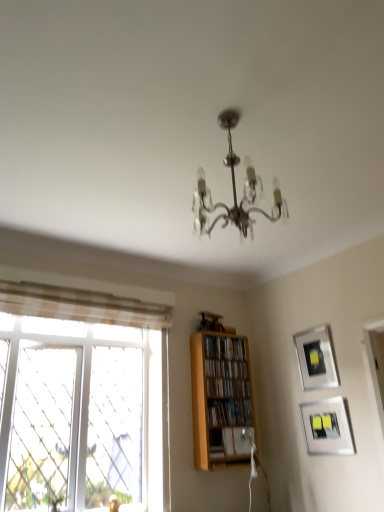
Question: Can you confirm if wooden bookshelf at center, marked as the 1th book in a top-to-bottom arrangement, is smaller than wooden bookshelf at center, the second book viewed from the top?

Choices:
 (A) yes
 (B) no

Answer: (B)

Question: Considering the relative sizes of wooden bookshelf at center, acting as the fifth book starting from the bottom, and wooden bookshelf at center, the 4th book from the bottom, in the image provided, is wooden bookshelf at center, acting as the fifth book starting from the bottom, taller than wooden bookshelf at center, the 4th book from the bottom,?

Choices:
 (A) no
 (B) yes

Answer: (B)

Question: Is wooden bookshelf at center, marked as the 1th book in a top-to-bottom arrangement, thinner than wooden bookshelf at center, the second book viewed from the top?

Choices:
 (A) yes
 (B) no

Answer: (B)

Question: Is wooden bookshelf at center, acting as the fifth book starting from the bottom, not within wooden bookshelf at center, the second book viewed from the top?

Choices:
 (A) no
 (B) yes

Answer: (B)

Question: Can you confirm if wooden bookshelf at center, marked as the 1th book in a top-to-bottom arrangement, is positioned to the right of wooden bookshelf at center, the 4th book from the bottom?

Choices:
 (A) yes
 (B) no

Answer: (B)

Question: Considering the positions of wooden bookshelf at center, the second book viewed from the top, and wooden shelf at center in the image, is wooden bookshelf at center, the second book viewed from the top, wider or thinner than wooden shelf at center?

Choices:
 (A) thin
 (B) wide

Answer: (A)

Question: From a real-world perspective, is wooden bookshelf at center, the second book viewed from the top, positioned above or below wooden shelf at center?

Choices:
 (A) below
 (B) above

Answer: (B)

Question: From the image's perspective, is wooden bookshelf at center, the second book viewed from the top, located above or below wooden shelf at center?

Choices:
 (A) above
 (B) below

Answer: (A)

Question: Would you say wooden bookshelf at center, the 4th book from the bottom, is inside or outside wooden shelf at center?

Choices:
 (A) outside
 (B) inside

Answer: (B)

Question: Does point (29, 350) appear closer or farther from the camera than point (337, 434)?

Choices:
 (A) farther
 (B) closer

Answer: (A)

Question: Would you say clear glass window at left is to the left or to the right of matte silver picture frame at lower right, the 1th picture frame from the bottom, in the picture?

Choices:
 (A) right
 (B) left

Answer: (B)

Question: Is clear glass window at left bigger or smaller than matte silver picture frame at lower right, which appears as the second picture frame when viewed from the top?

Choices:
 (A) big
 (B) small

Answer: (A)

Question: Would you say clear glass window at left is inside or outside matte silver picture frame at lower right, the 1th picture frame from the bottom?

Choices:
 (A) inside
 (B) outside

Answer: (B)

Question: In terms of size, does wooden bookshelf at center, the 3th book from the bottom, appear bigger or smaller than wooden bookshelf at center, acting as the fifth book starting from the bottom?

Choices:
 (A) small
 (B) big

Answer: (A)

Question: Is wooden bookshelf at center, the 3th book from the bottom, inside or outside of wooden bookshelf at center, acting as the fifth book starting from the bottom?

Choices:
 (A) outside
 (B) inside

Answer: (A)